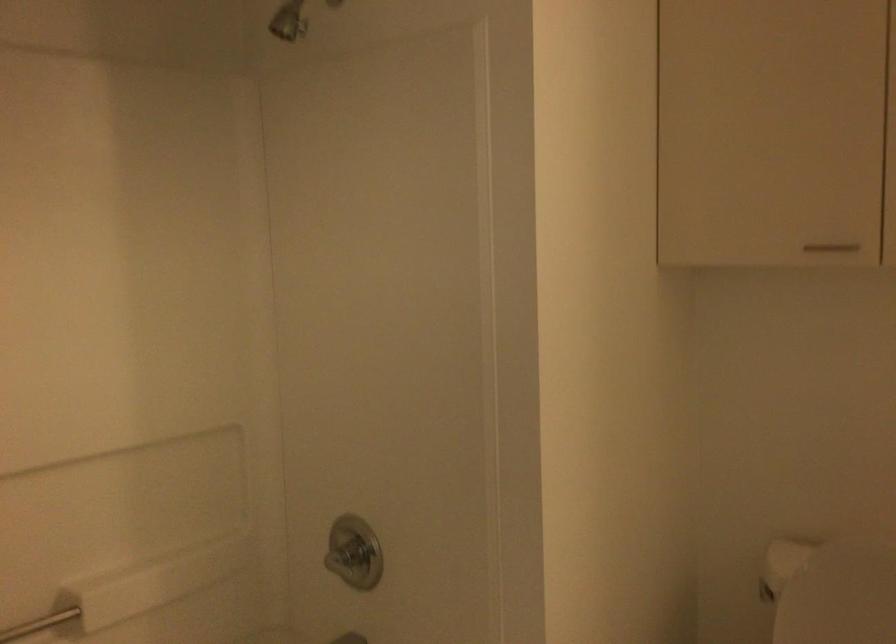
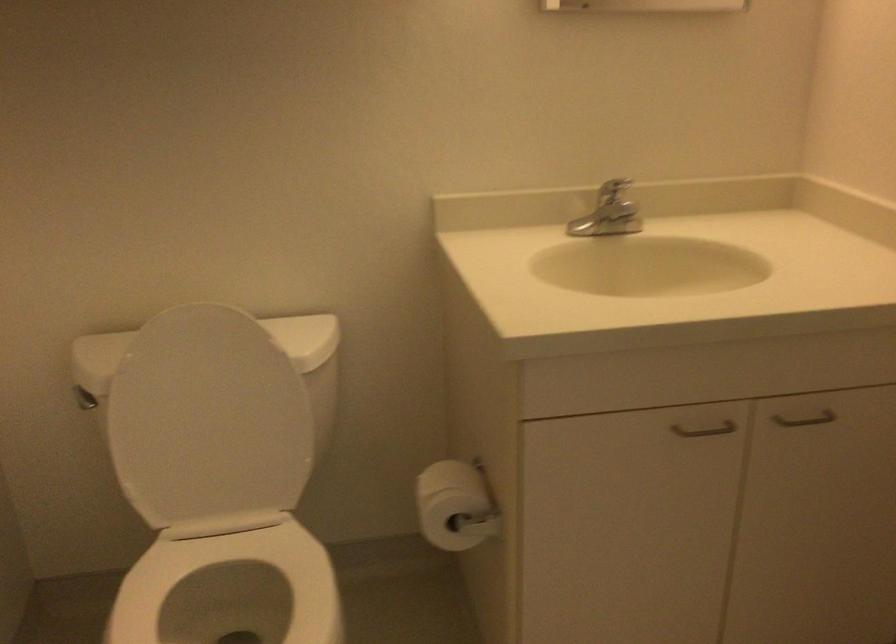
The images are taken continuously from a first-person perspective. In which direction is your viewpoint rotating?

The camera rotated toward right-down.